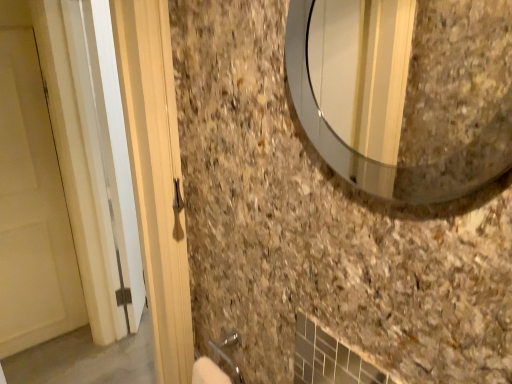
Question: Is point (19, 228) positioned closer to the camera than point (304, 1)?

Choices:
 (A) closer
 (B) farther

Answer: (B)

Question: Looking at their shapes, would you say white matte door at left is wider or thinner than clear glass mirror at upper right?

Choices:
 (A) thin
 (B) wide

Answer: (A)

Question: From a real-world perspective, relative to clear glass mirror at upper right, is white matte door at left vertically above or below?

Choices:
 (A) below
 (B) above

Answer: (A)

Question: Is point (321, 119) positioned closer to the camera than point (45, 99)?

Choices:
 (A) closer
 (B) farther

Answer: (A)

Question: From the image's perspective, is clear glass mirror at upper right positioned above or below white matte door at left?

Choices:
 (A) below
 (B) above

Answer: (B)

Question: Would you say clear glass mirror at upper right is to the left or to the right of white matte door at left in the picture?

Choices:
 (A) right
 (B) left

Answer: (A)

Question: From a real-world perspective, is clear glass mirror at upper right physically located above or below white matte door at left?

Choices:
 (A) above
 (B) below

Answer: (A)